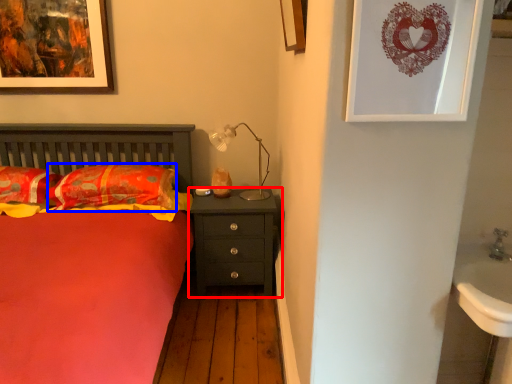
Question: Which object is further to the camera taking this photo, nightstand (highlighted by a red box) or pillow (highlighted by a blue box)?

Choices:
 (A) nightstand
 (B) pillow

Answer: (A)